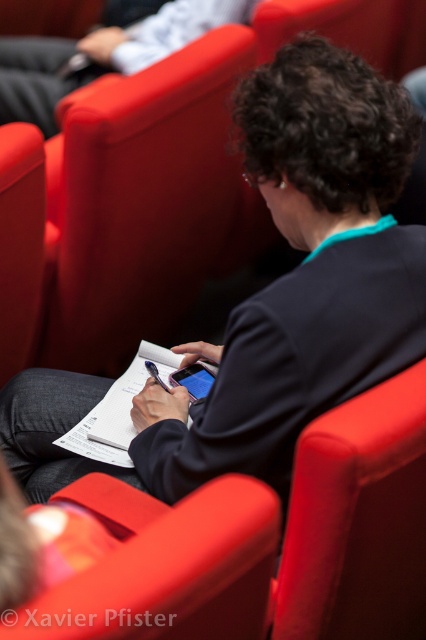
You are organizing a presentation and need to know if the matte black jacket at upper center can be placed on top of the white paper at center without covering the entire paper. Based on their sizes, what do you think?

The matte black jacket at upper center is larger than the white paper at center. Therefore, placing the matte black jacket at upper center on top of the white paper at center would cover the entire paper.

You are sitting in the matte red armchair at center and want to hand a book to someone standing in front of you. Can you reach the white paper at center to place the book on it without moving from your seat?

The matte red armchair at center is closer to the viewer than the white paper at center, so you cannot reach the white paper at center from your seated position in the matte red armchair at center.